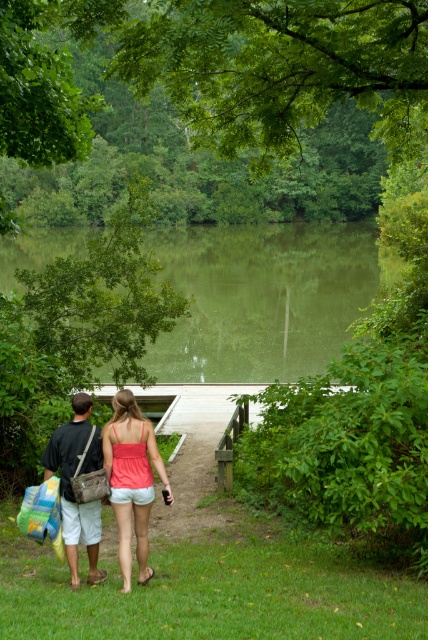
Question: Does green reflective water at center appear on the left side of matte coral tank top at center?

Choices:
 (A) no
 (B) yes

Answer: (B)

Question: Which point is closer to the camera?

Choices:
 (A) (64, 493)
 (B) (237, 292)

Answer: (A)

Question: Does green reflective water at center have a lesser width compared to matte brown bag at center?

Choices:
 (A) no
 (B) yes

Answer: (A)

Question: Which is nearer to the matte coral tank top at center?

Choices:
 (A) green reflective water at center
 (B) matte brown bag at center

Answer: (B)

Question: Which object is the closest to the matte brown bag at center?

Choices:
 (A) matte coral tank top at center
 (B) green reflective water at center

Answer: (A)

Question: Considering the relative positions of green reflective water at center and matte brown bag at center in the image provided, where is green reflective water at center located with respect to matte brown bag at center?

Choices:
 (A) below
 (B) above

Answer: (B)